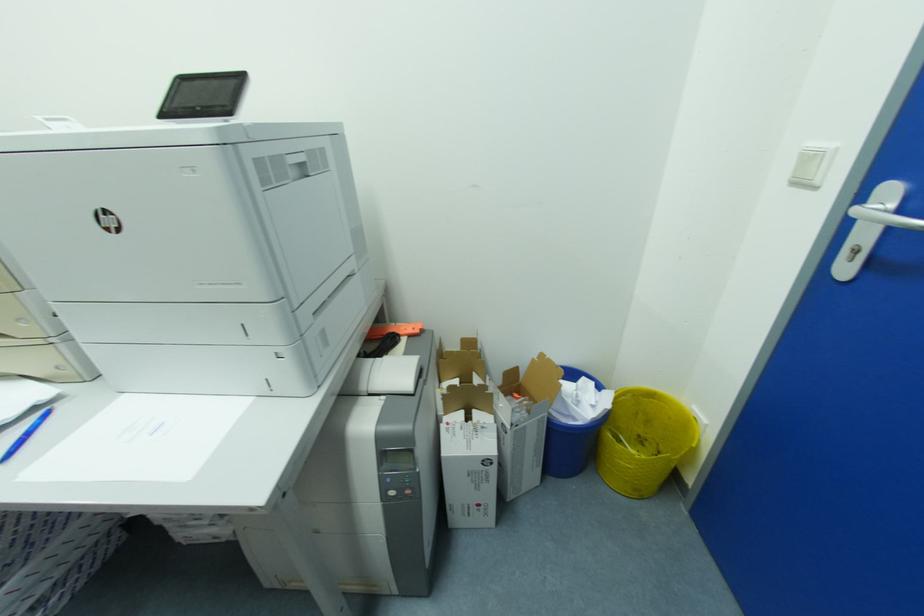
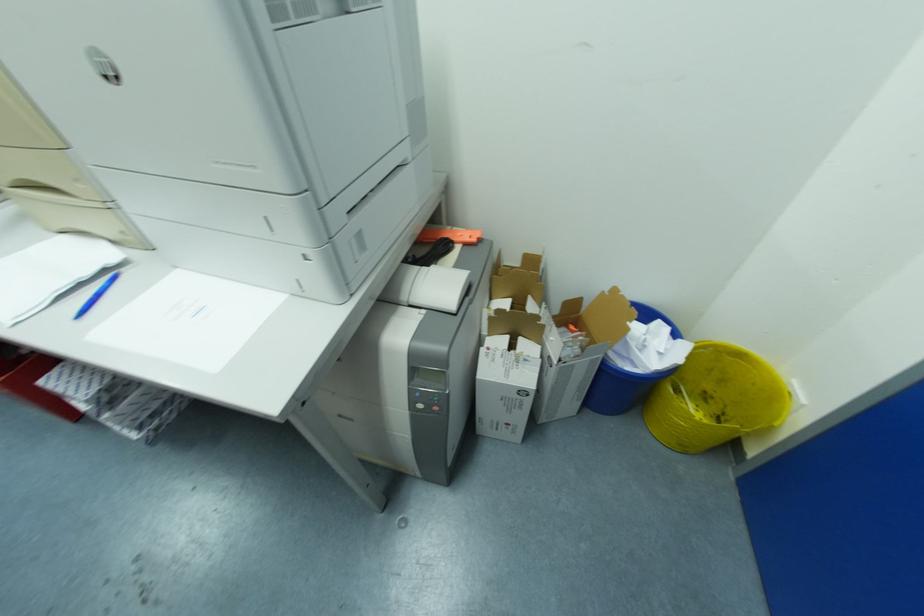
Question: How did the camera likely rotate?

Choices:
 (A) Left
 (B) Right
 (C) Up
 (D) Down

Answer: (D)